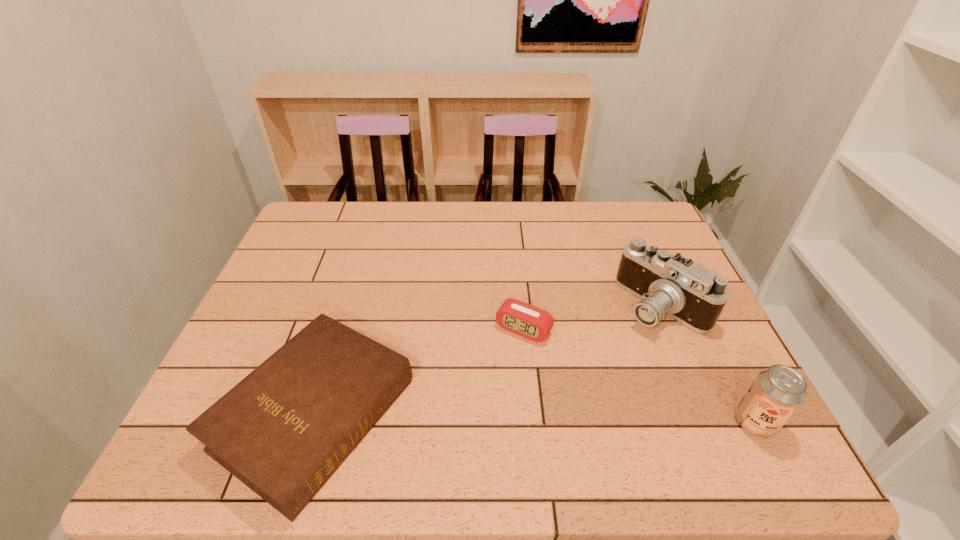
What are the coordinates of `object that is at the near right corner` in the screenshot? It's located at (777, 392).

Where is `vacant space at the far edge`? Image resolution: width=960 pixels, height=540 pixels. vacant space at the far edge is located at coordinates (427, 230).

I want to click on free space at the near edge of the desktop, so click(x=534, y=421).

Where is `vacant space at the left edge`? The image size is (960, 540). vacant space at the left edge is located at coordinates (286, 319).

The width and height of the screenshot is (960, 540). In the image, there is a desktop. Find the location of `vacant area at the right edge`. vacant area at the right edge is located at coordinates coord(663,319).

In the image, there is a desktop. At what (x,y) coordinates should I click in order to perform the action: click on vacant space at the far left corner. Please return your answer as a coordinate pair (x, y). Looking at the image, I should click on (317, 241).

Identify the location of free region at the near right corner of the desktop. (719, 401).

What are the coordinates of `vacant space that is in between the beer can and the third tallest object` in the screenshot? It's located at (535, 418).

I want to click on free space that is in between the second shortest object and the beer can, so click(x=535, y=418).

Where is `unoccupied position between the beer can and the leftmost object`? This screenshot has width=960, height=540. unoccupied position between the beer can and the leftmost object is located at coordinates (535, 418).